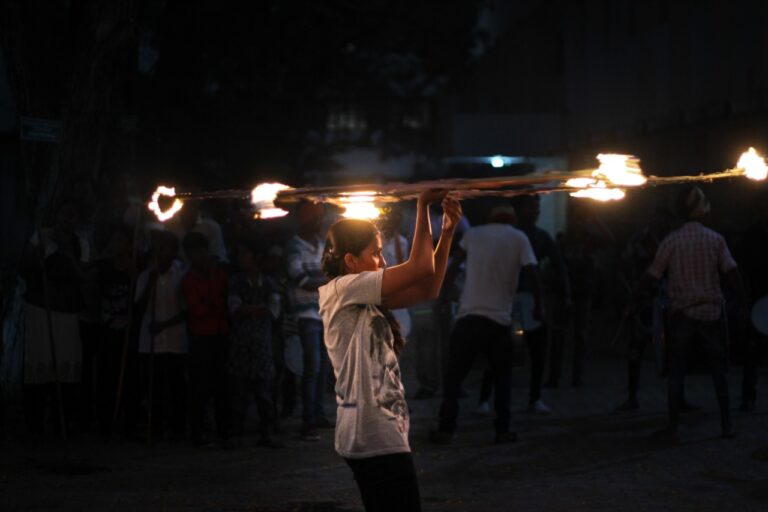
At what (x,y) coordinates should I click in order to perform the action: click on lightbulb. Please return your answer as a coordinate pair (x, y). This screenshot has height=512, width=768. Looking at the image, I should click on (497, 161).